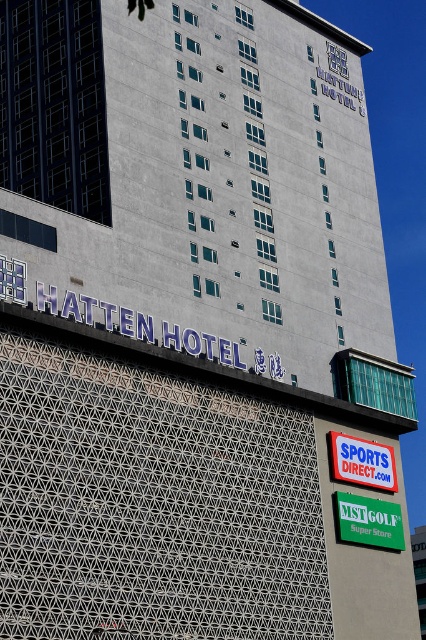
What do you see at coordinates (368, 522) in the screenshot? Image resolution: width=426 pixels, height=640 pixels. I see `green plastic mst golf super store sign at lower right` at bounding box center [368, 522].

Can you confirm if green plastic mst golf super store sign at lower right is taller than blue plastic signboard at lower right?

Indeed, green plastic mst golf super store sign at lower right has a greater height compared to blue plastic signboard at lower right.

Which is behind, point (348, 525) or point (368, 445)?

Point (368, 445)

Locate an element on the screen. green plastic mst golf super store sign at lower right is located at coordinates (368, 522).